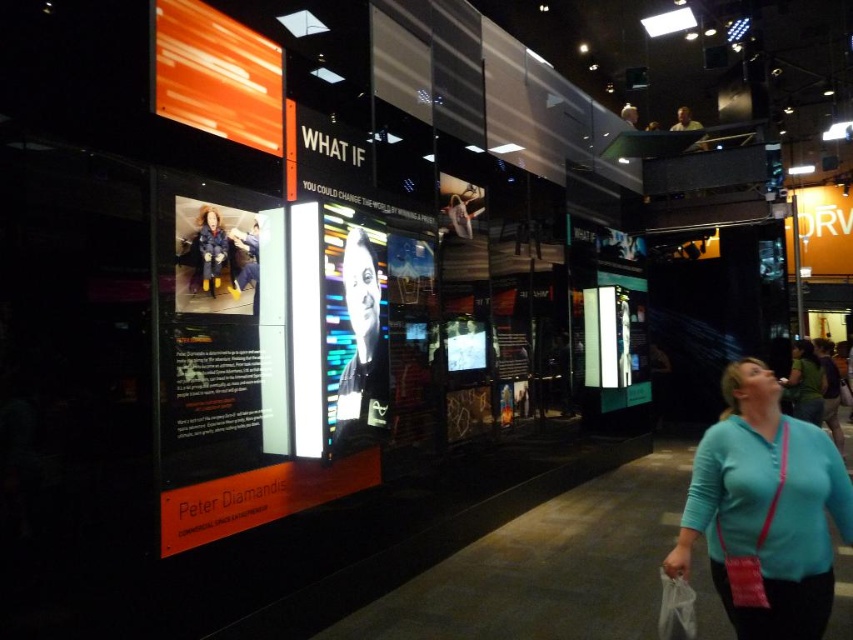
Question: Is black glossy portrait at center further to the viewer compared to blue denim jacket at center?

Choices:
 (A) yes
 (B) no

Answer: (A)

Question: Is blue cotton shirt at lower right wider than blue denim jacket at center?

Choices:
 (A) yes
 (B) no

Answer: (A)

Question: Can you confirm if blue cotton shirt at lower right is smaller than blue denim jacket at center?

Choices:
 (A) no
 (B) yes

Answer: (A)

Question: Which point is farther to the camera?

Choices:
 (A) (378, 344)
 (B) (213, 280)
 (C) (184, 67)
 (D) (773, 516)

Answer: (A)

Question: Which object appears closest to the camera in this image?

Choices:
 (A) blue denim jacket at center
 (B) blue cotton shirt at lower right

Answer: (B)

Question: Which object appears farthest from the camera in this image?

Choices:
 (A) blue cotton shirt at lower right
 (B) orange glossy screen at upper left

Answer: (B)